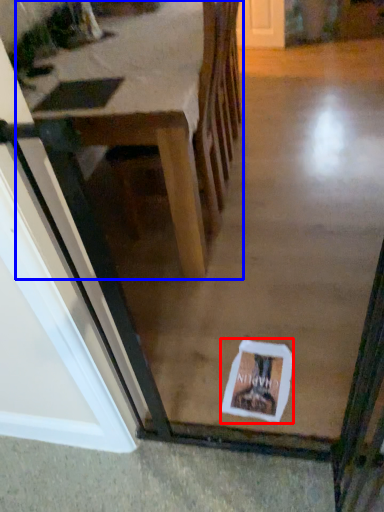
Question: Which object is closer to the camera taking this photo, postcard (highlighted by a red box) or table (highlighted by a blue box)?

Choices:
 (A) postcard
 (B) table

Answer: (B)